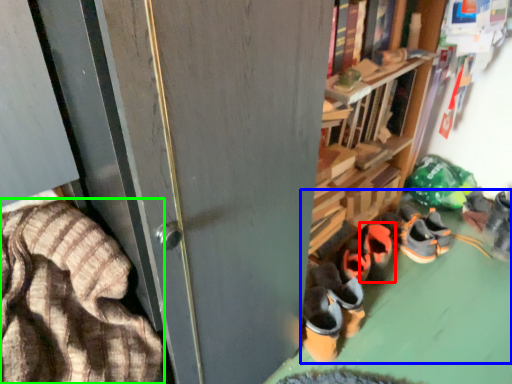
Question: Which object is positioned closest to footwear (highlighted by a red box)? Select from footwear (highlighted by a blue box) and blanket (highlighted by a green box).

Choices:
 (A) footwear
 (B) blanket

Answer: (A)